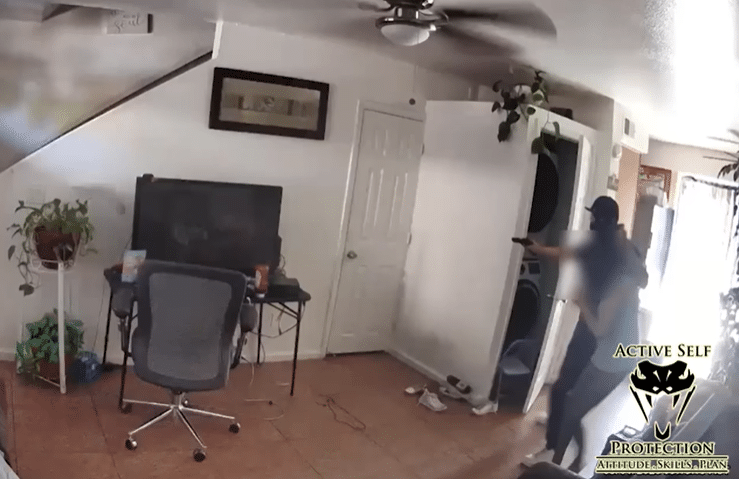
Where is `tile floor`? This screenshot has height=479, width=739. tile floor is located at coordinates (307, 450).